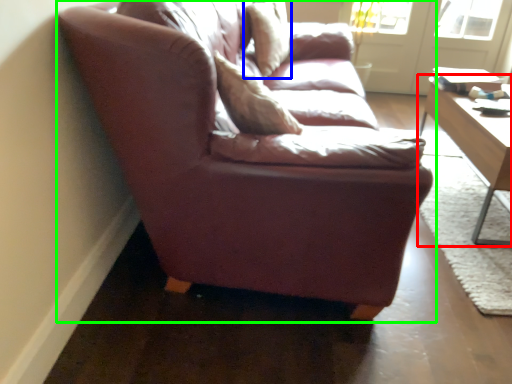
Question: Considering the real-world distances, which object is farthest from table (highlighted by a red box)? pillow (highlighted by a blue box) or studio couch (highlighted by a green box)?

Choices:
 (A) pillow
 (B) studio couch

Answer: (A)